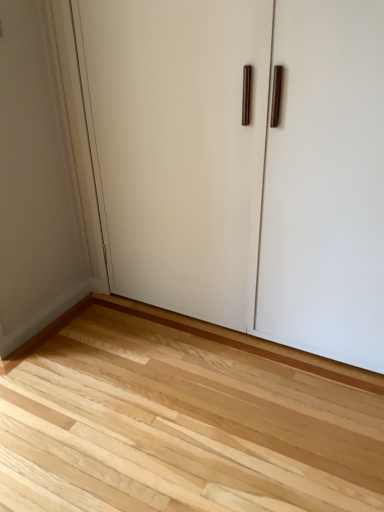
This screenshot has height=512, width=384. What do you see at coordinates (245, 164) in the screenshot?
I see `white matte door at center` at bounding box center [245, 164].

Identify the location of white matte door at center. (245, 164).

Locate an element on the screen. white matte door at center is located at coordinates (245, 164).